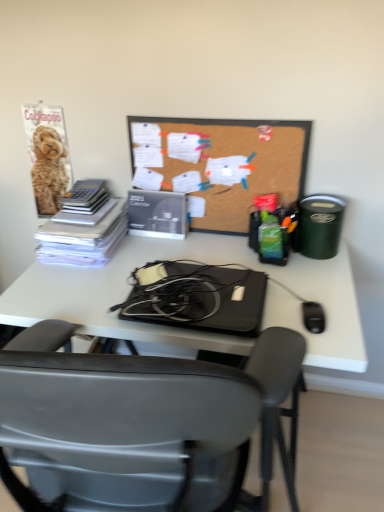
I want to click on free space in front of matte black calendar at center, so click(160, 249).